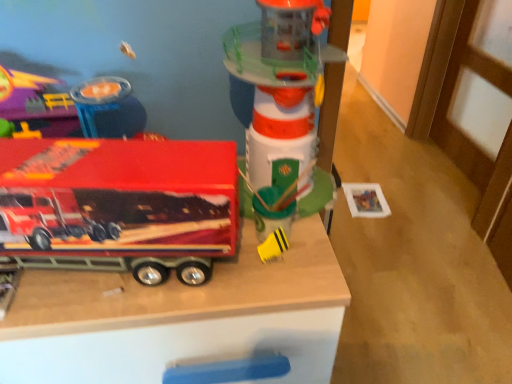
Identify the location of vacant area in front of yellow rubber duck at center, the 3th toy viewed from the left. (270, 298).